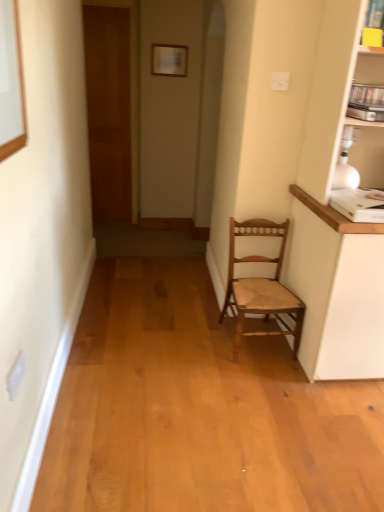
In order to click on vacant area that is in front of wooden chair at center in this screenshot , I will do `click(268, 383)`.